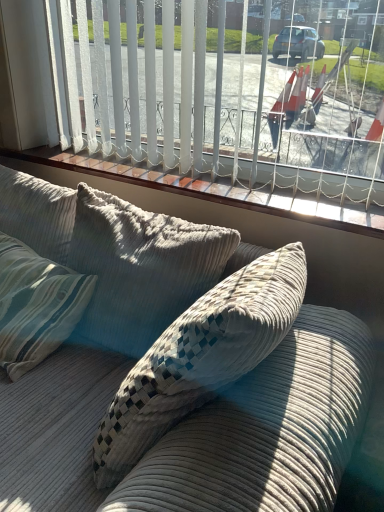
Question: Considering the relative sizes of corduroy couch at center and wooden window sill at upper center in the image provided, is corduroy couch at center wider than wooden window sill at upper center?

Choices:
 (A) yes
 (B) no

Answer: (A)

Question: Is corduroy couch at center in front of wooden window sill at upper center?

Choices:
 (A) no
 (B) yes

Answer: (B)

Question: Does corduroy couch at center come behind wooden window sill at upper center?

Choices:
 (A) yes
 (B) no

Answer: (B)

Question: Is corduroy couch at center taller than wooden window sill at upper center?

Choices:
 (A) no
 (B) yes

Answer: (B)

Question: From the image's perspective, is corduroy couch at center on wooden window sill at upper center?

Choices:
 (A) no
 (B) yes

Answer: (A)

Question: Can you see corduroy couch at center touching wooden window sill at upper center?

Choices:
 (A) no
 (B) yes

Answer: (A)

Question: From the image's perspective, is white vertical blinds at upper center above corduroy couch at center?

Choices:
 (A) no
 (B) yes

Answer: (B)

Question: Can you confirm if white vertical blinds at upper center is thinner than corduroy couch at center?

Choices:
 (A) no
 (B) yes

Answer: (B)

Question: From a real-world perspective, is white vertical blinds at upper center under corduroy couch at center?

Choices:
 (A) no
 (B) yes

Answer: (A)

Question: Is white vertical blinds at upper center to the left of corduroy couch at center from the viewer's perspective?

Choices:
 (A) yes
 (B) no

Answer: (A)

Question: Is white vertical blinds at upper center closer to the viewer compared to corduroy couch at center?

Choices:
 (A) no
 (B) yes

Answer: (A)

Question: From the image's perspective, is white vertical blinds at upper center below corduroy couch at center?

Choices:
 (A) no
 (B) yes

Answer: (A)

Question: Is white vertical blinds at upper center thinner than wooden window sill at upper center?

Choices:
 (A) no
 (B) yes

Answer: (B)